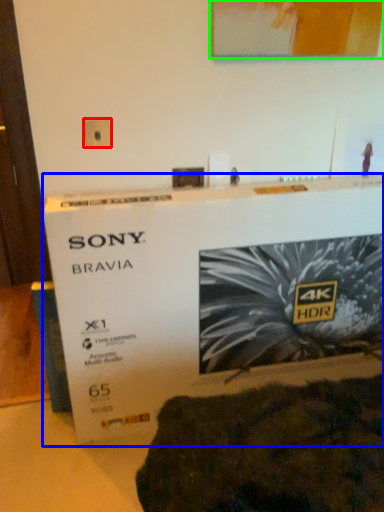
Question: Based on their relative distances, which object is nearer to electric outlet (highlighted by a red box)? Choose from poster (highlighted by a blue box) and picture frame (highlighted by a green box).

Choices:
 (A) poster
 (B) picture frame

Answer: (B)